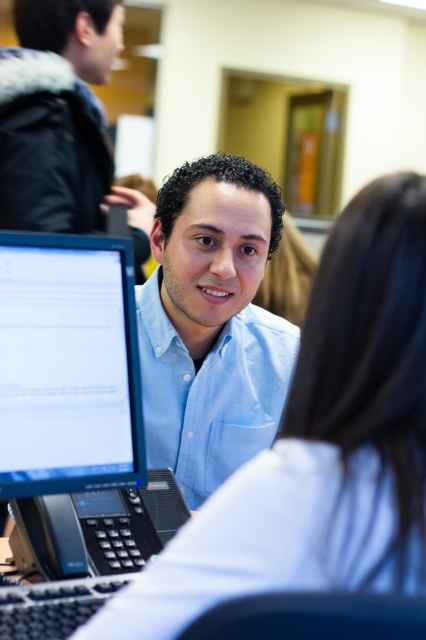
Identify the location of light blue shirt at center. (212, 323).

Describe the element at coordinates (212, 323) in the screenshot. I see `light blue shirt at center` at that location.

Image resolution: width=426 pixels, height=640 pixels. In order to click on light blue shirt at center in this screenshot , I will do `click(212, 323)`.

Which of these two, white fabric shirt at center or light blue shirt at center, stands taller?

With more height is light blue shirt at center.

Is point (386, 198) more distant than point (190, 417)?

No, (386, 198) is closer to viewer.

Locate an element on the screen. This screenshot has height=640, width=426. white fabric shirt at center is located at coordinates (319, 444).

Does matte black monitor at left appear on the right side of matte blue shirt at center?

Yes, matte black monitor at left is to the right of matte blue shirt at center.

Which is above, matte black monitor at left or matte blue shirt at center?

matte blue shirt at center is higher up.

Is point (20, 470) farther from camera compared to point (72, 154)?

No.

Locate an element on the screen. matte black monitor at left is located at coordinates (68, 364).